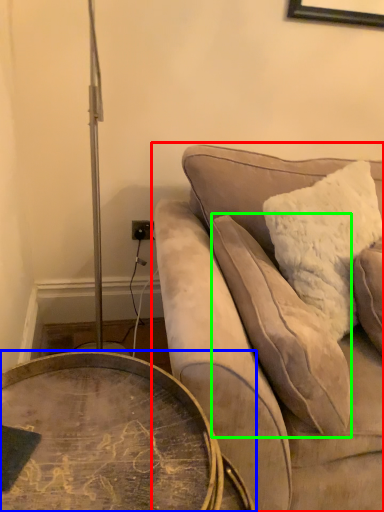
Question: Considering the real-world distances, which object is farthest from studio couch (highlighted by a red box)? coffee table (highlighted by a blue box) or pillow (highlighted by a green box)?

Choices:
 (A) coffee table
 (B) pillow

Answer: (A)